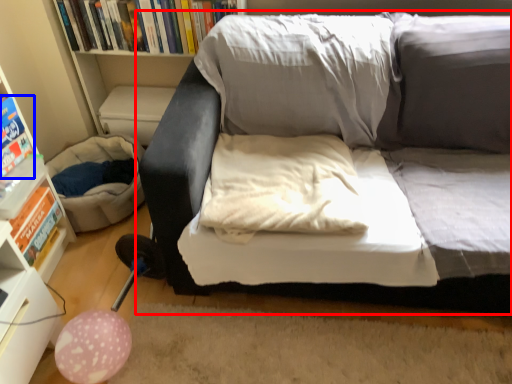
Question: Which of the following is the closest to the observer, studio couch (highlighted by a red box) or paperback book (highlighted by a blue box)?

Choices:
 (A) studio couch
 (B) paperback book

Answer: (A)